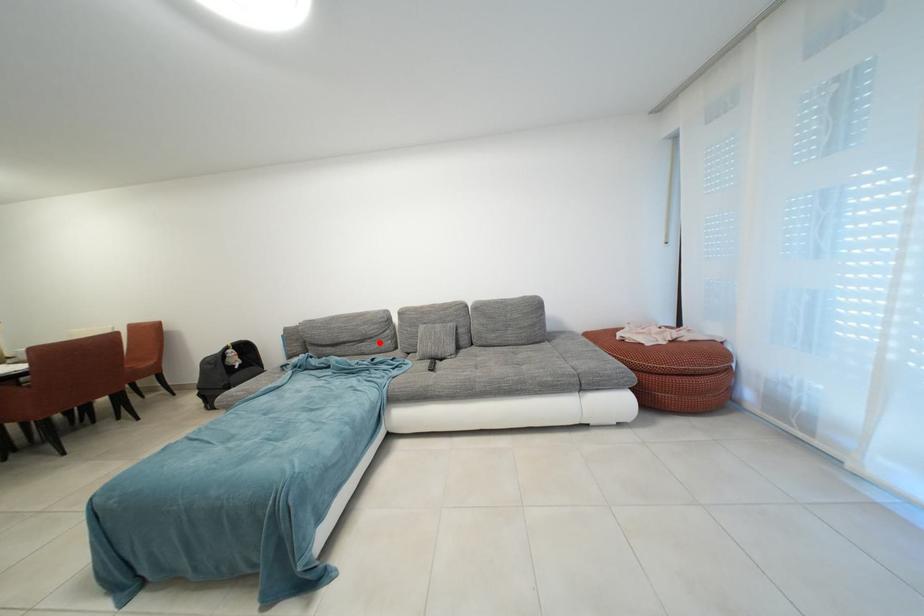
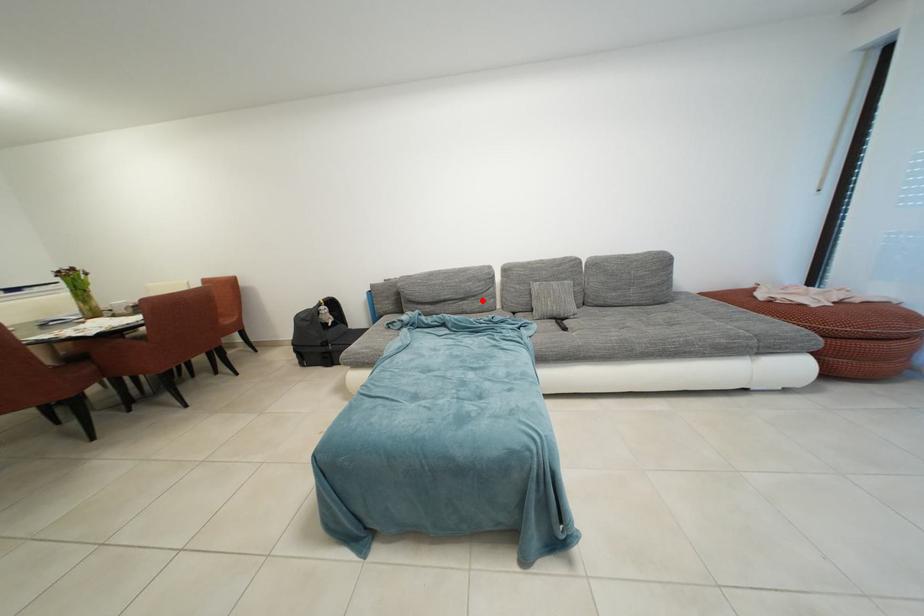
I am providing you with two images of the same scene from different viewpoints. A red point is marked on the first image and another point is marked on the second image. Is the marked point in image1 the same physical position as the marked point in image2?

Yes